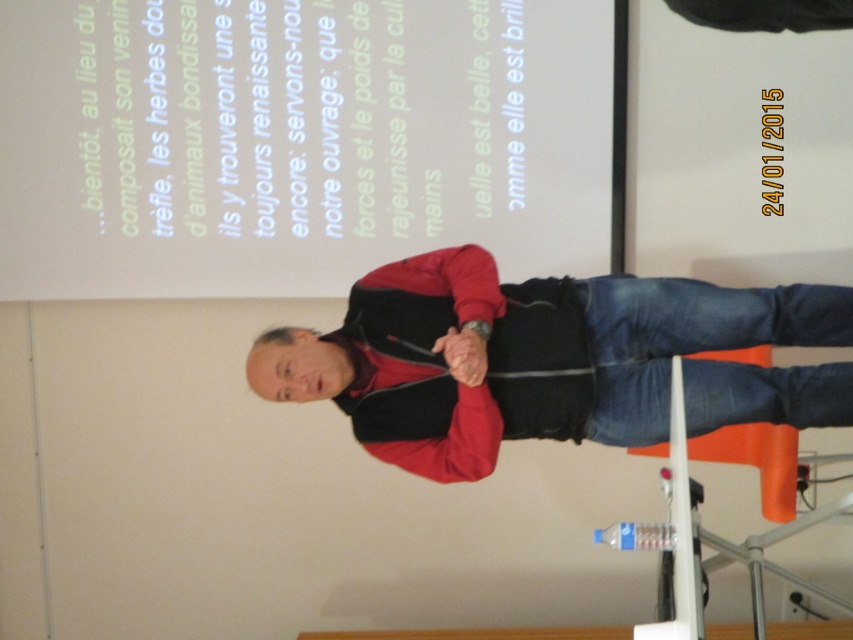
Is white paper at upper center to the left of blue denim jeans at lower center from the viewer's perspective?

Correct, you'll find white paper at upper center to the left of blue denim jeans at lower center.

Is white paper at upper center bigger than blue denim jeans at lower center?

Yes.

Who is more distant from viewer, (187, 161) or (628, 401)?

Positioned behind is point (187, 161).

The width and height of the screenshot is (853, 640). In order to click on white paper at upper center in this screenshot , I will do `click(296, 140)`.

Between white paper at upper center and red matte jacket at center, which one appears on the left side from the viewer's perspective?

From the viewer's perspective, white paper at upper center appears more on the left side.

Who is higher up, white paper at upper center or red matte jacket at center?

white paper at upper center

Is point (206, 198) less distant than point (479, 372)?

That is False.

The width and height of the screenshot is (853, 640). What are the coordinates of `white paper at upper center` in the screenshot? It's located at (296, 140).

Who is higher up, red matte jacket at center or blue denim jeans at lower center?

red matte jacket at center

Can you confirm if red matte jacket at center is smaller than blue denim jeans at lower center?

No.

You are a GUI agent. You are given a task and a screenshot of the screen. Output one action in this format:
    pyautogui.click(x=<x>, y=<y>)
    Task: Click on the red matte jacket at center
    The image size is (853, 640).
    Given the screenshot: What is the action you would take?
    pyautogui.click(x=521, y=355)